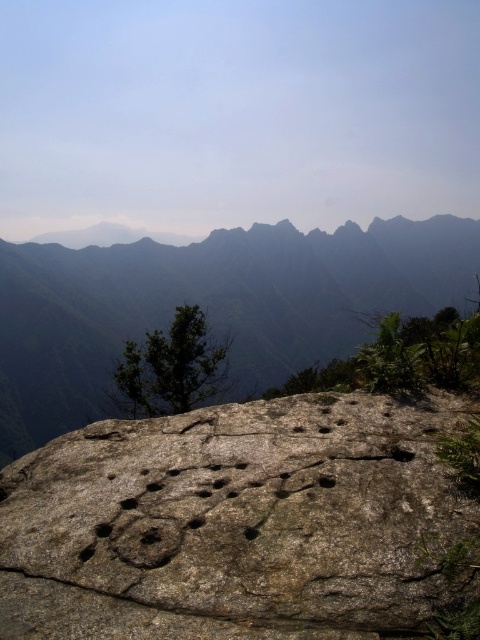
You are standing at the center of the image and want to locate the gray rough boulder at center. According to the coordinates provided, in which direction should you look to find it?

The gray rough boulder at center is located at coordinates point (237, 524). Since you are at the center, you should look towards the upper right direction to find it.